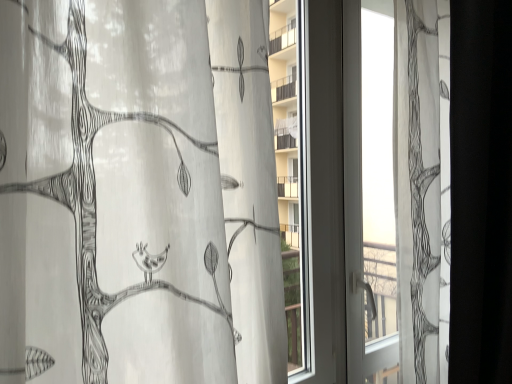
What is the approximate height of transparent fabric curtain at center?

4.49 feet.

Locate an element on the screen. Image resolution: width=512 pixels, height=384 pixels. transparent fabric curtain at center is located at coordinates (395, 198).

What do you see at coordinates (395, 198) in the screenshot? The image size is (512, 384). I see `transparent fabric curtain at center` at bounding box center [395, 198].

Find the location of `transparent fabric curtain at center`. transparent fabric curtain at center is located at coordinates (395, 198).